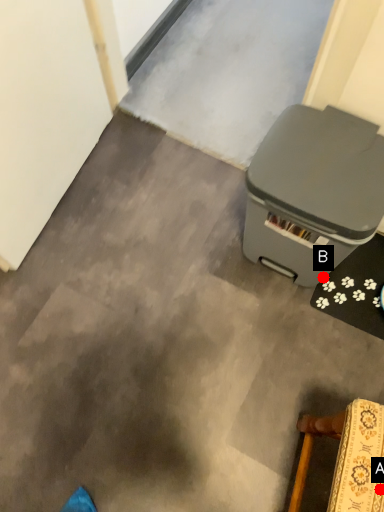
Question: Two points are circled on the image, labeled by A and B beside each circle. Which point is closer to the camera?

Choices:
 (A) A is closer
 (B) B is closer

Answer: (A)